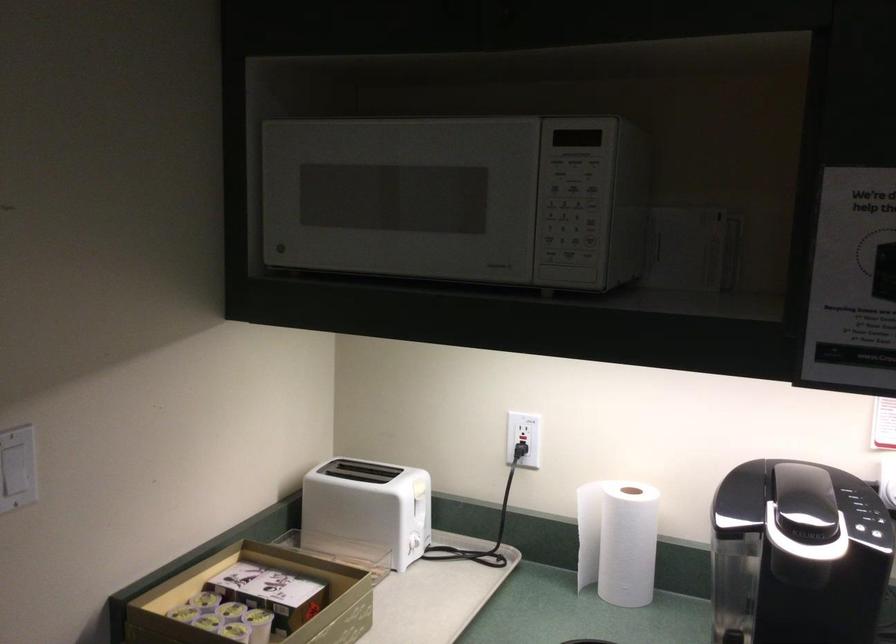
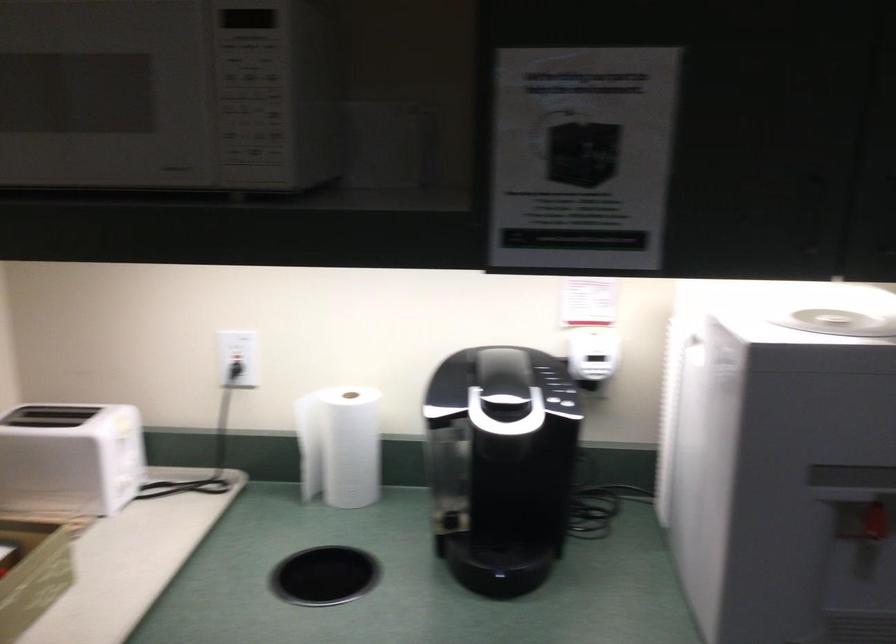
Question: The images are taken continuously from a first-person perspective. In which direction is your viewpoint rotating?

Choices:
 (A) Left
 (B) Right
 (C) Up
 (D) Down

Answer: (B)